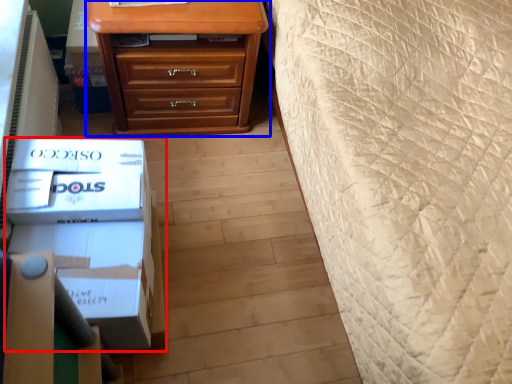
Question: Which point is further to the camera, box (highlighted by a red box) or chest of drawers (highlighted by a blue box)?

Choices:
 (A) box
 (B) chest of drawers

Answer: (B)